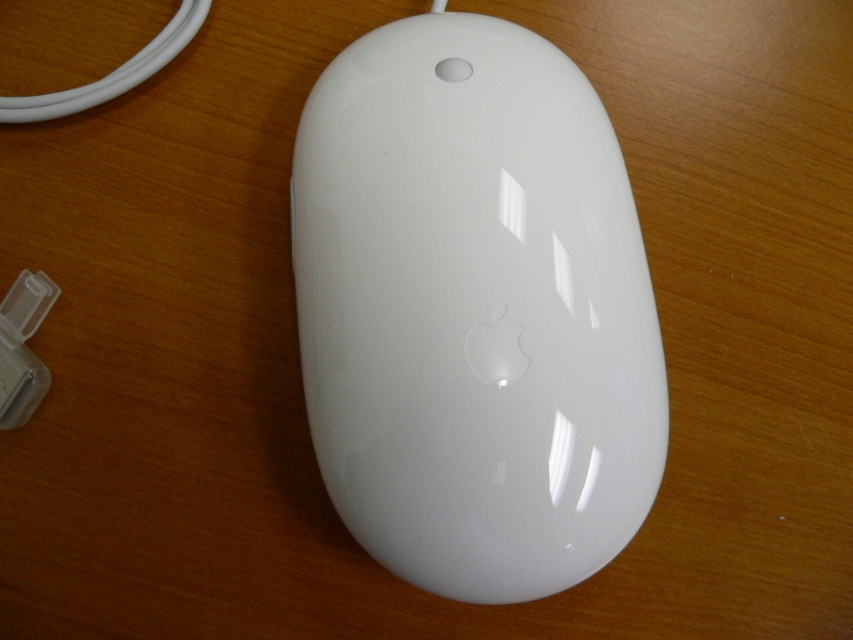
You are setting up a desk and want to place the white glossy mouse at center and the clear plastic charger at lower left. Considering their sizes, which object will require more vertical space?

The white glossy mouse at center requires more vertical space because it has a greater height compared to the clear plastic charger at lower left.

You need to place both the white glossy mouse at center and the clear plastic charger at lower left into a rectangular storage box. The box has a width just enough to fit the wider object. Which object should you place first to ensure both fit?

You should place the white glossy mouse at center first because it is wider than the clear plastic charger at lower left, ensuring there is enough space for both in the box.